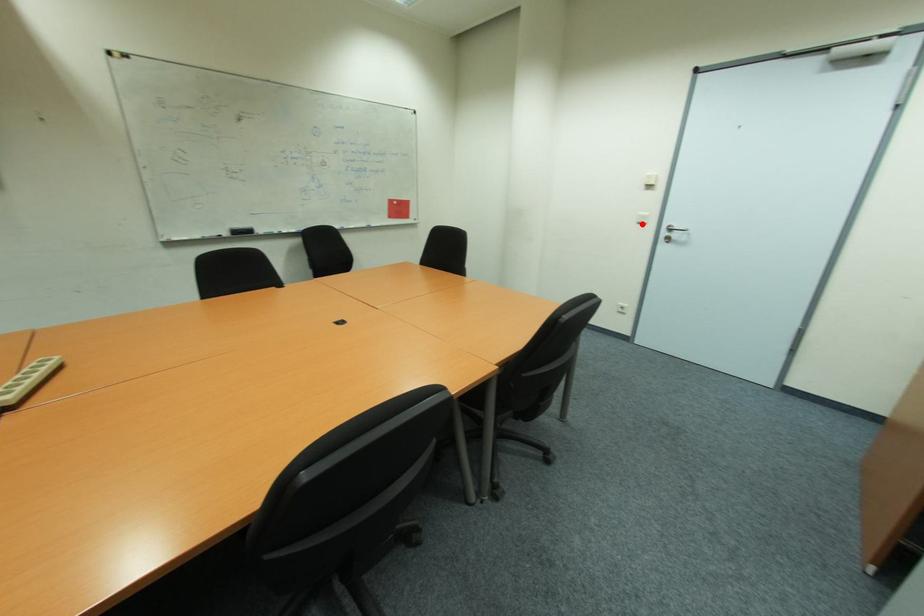
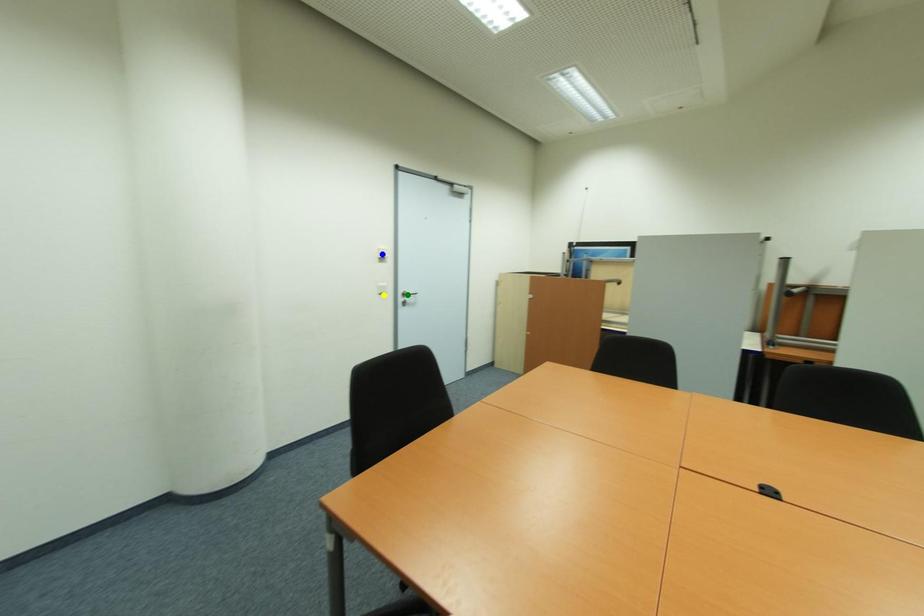
Question: I am providing you with two images of the same scene from different viewpoints. A red point is marked on the first image. You are given multiple points on the second image. Which spot in image 2 lines up with the point in image 1?

Choices:
 (A) blue point
 (B) green point
 (C) yellow point

Answer: (C)